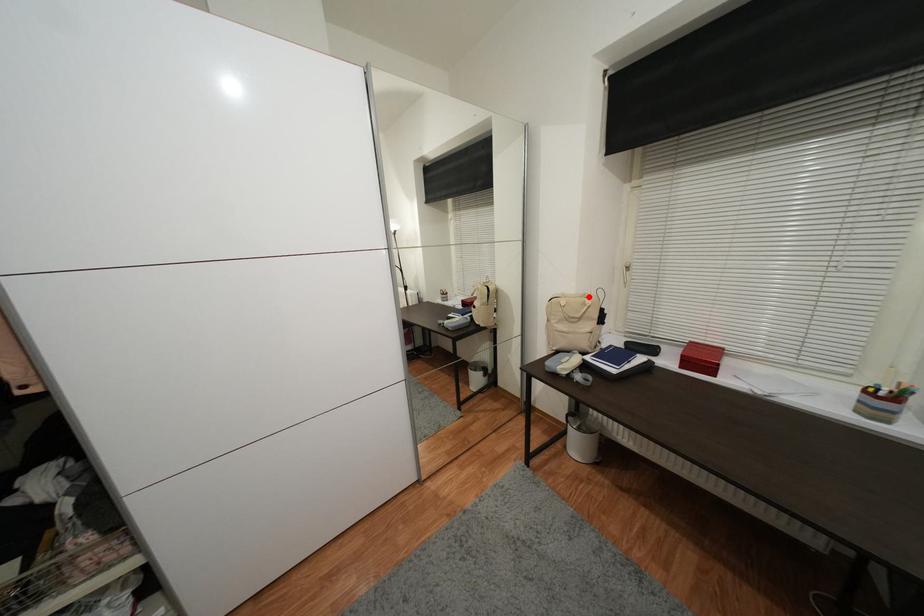
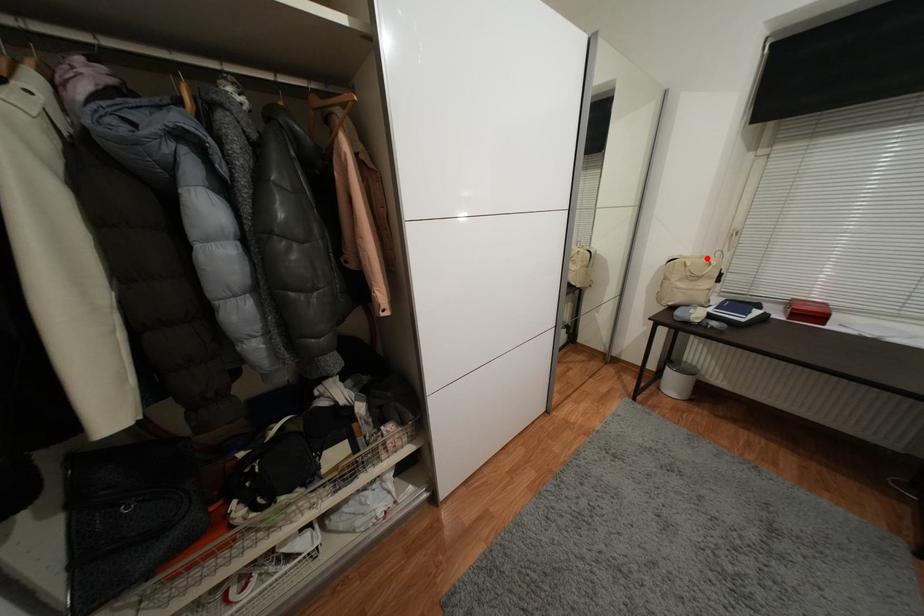
I am providing you with two images of the same scene from different viewpoints. A red point is marked on the first image and another point is marked on the second image. Is the marked point in image1 the same physical position as the marked point in image2?

Yes